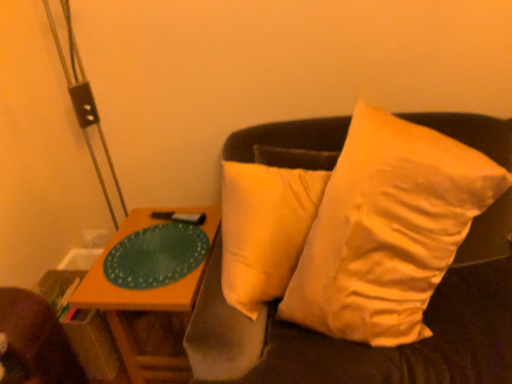
The image size is (512, 384). What are the coordinates of `vacant area on top of wooden table at left (from a real-world perspective)` in the screenshot? It's located at tap(153, 247).